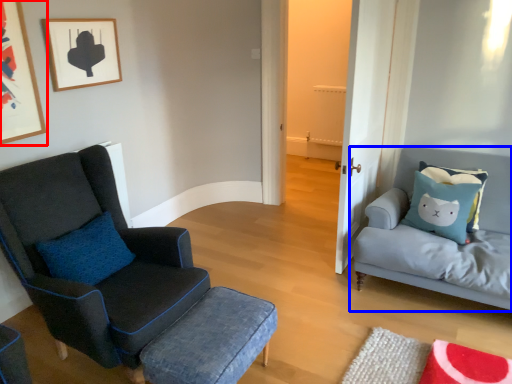
Question: Which point is closer to the camera, picture frame (highlighted by a red box) or studio couch (highlighted by a blue box)?

Choices:
 (A) picture frame
 (B) studio couch

Answer: (A)